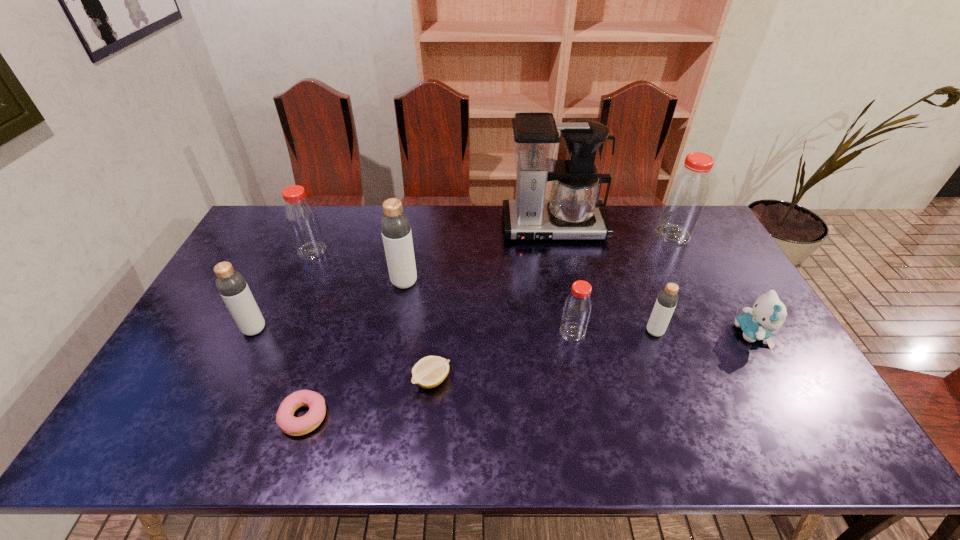
At what (x,y) coordinates should I click in order to perform the action: click on the smallest gray bottle. Please return your answer as a coordinate pair (x, y). Looking at the image, I should click on (667, 299).

Identify the location of the rightmost gray bottle. (667, 299).

Locate an element on the screen. The image size is (960, 540). kitten is located at coordinates (768, 314).

This screenshot has height=540, width=960. I want to click on blue kitten, so click(768, 314).

The width and height of the screenshot is (960, 540). I want to click on the fifth object from left to right, so click(428, 372).

Locate an element on the screen. lemon is located at coordinates (428, 372).

The height and width of the screenshot is (540, 960). Identify the location of the eighth object from right to left. (295, 426).

Where is `the nearest object`? The height and width of the screenshot is (540, 960). the nearest object is located at coordinates pyautogui.click(x=295, y=426).

The height and width of the screenshot is (540, 960). I want to click on free space located 0.380m at the front of the gray coffee maker where the controls are located, so click(574, 331).

The width and height of the screenshot is (960, 540). In order to click on free space located 0.100m on the back of the rightmost red bottle in this screenshot , I will do `click(660, 208)`.